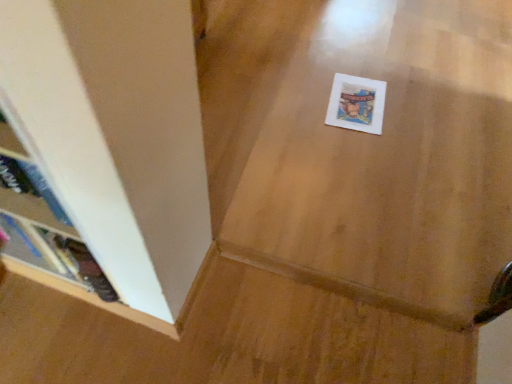
Question: Is wooden bookshelf at left surrounding white paper postcard at center?

Choices:
 (A) yes
 (B) no

Answer: (B)

Question: Are wooden bookshelf at left and white paper postcard at center located far from each other?

Choices:
 (A) yes
 (B) no

Answer: (A)

Question: Would you say wooden bookshelf at left is outside white paper postcard at center?

Choices:
 (A) no
 (B) yes

Answer: (B)

Question: From the image's perspective, does wooden bookshelf at left appear higher than white paper postcard at center?

Choices:
 (A) no
 (B) yes

Answer: (A)

Question: Is wooden bookshelf at left in front of white paper postcard at center?

Choices:
 (A) no
 (B) yes

Answer: (B)

Question: Could you tell me if wooden bookshelf at left is turned towards white paper postcard at center?

Choices:
 (A) yes
 (B) no

Answer: (B)

Question: Considering the relative sizes of white paper postcard at center and wooden bookshelf at left in the image provided, is white paper postcard at center wider than wooden bookshelf at left?

Choices:
 (A) yes
 (B) no

Answer: (A)

Question: Could you tell me if white paper postcard at center is turned towards wooden bookshelf at left?

Choices:
 (A) yes
 (B) no

Answer: (B)

Question: Is white paper postcard at center positioned before wooden bookshelf at left?

Choices:
 (A) yes
 (B) no

Answer: (B)

Question: Is the depth of white paper postcard at center greater than that of wooden bookshelf at left?

Choices:
 (A) yes
 (B) no

Answer: (A)

Question: Is white paper postcard at center looking in the opposite direction of wooden bookshelf at left?

Choices:
 (A) yes
 (B) no

Answer: (B)

Question: From the image's perspective, is white paper postcard at center located beneath wooden bookshelf at left?

Choices:
 (A) no
 (B) yes

Answer: (A)

Question: Is white paper postcard at center taller or shorter than wooden bookshelf at left?

Choices:
 (A) short
 (B) tall

Answer: (A)